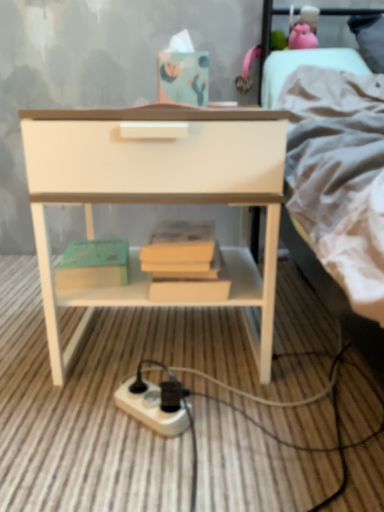
Locate an element on the screen. The image size is (384, 512). green matte paperback book at lower left is located at coordinates (93, 264).

What do you see at coordinates (340, 177) in the screenshot?
I see `light gray fabric bed at upper right` at bounding box center [340, 177].

Locate an element on the screen. green matte paperback book at lower left is located at coordinates (93, 264).

Considering the relative sizes of white plastic power plugs and sockets at lower center and green matte paperback book at lower left in the image provided, is white plastic power plugs and sockets at lower center shorter than green matte paperback book at lower left?

Indeed, white plastic power plugs and sockets at lower center has a lesser height compared to green matte paperback book at lower left.

From a real-world perspective, does white plastic power plugs and sockets at lower center sit lower than green matte paperback book at lower left?

Yes, from a real-world perspective, white plastic power plugs and sockets at lower center is under green matte paperback book at lower left.

Considering the sizes of objects white plastic power plugs and sockets at lower center and green matte paperback book at lower left in the image provided, who is wider, white plastic power plugs and sockets at lower center or green matte paperback book at lower left?

Wider between the two is green matte paperback book at lower left.

Considering the sizes of white plastic power plugs and sockets at lower center and white glossy nightstand at center in the image, is white plastic power plugs and sockets at lower center taller or shorter than white glossy nightstand at center?

white plastic power plugs and sockets at lower center is shorter than white glossy nightstand at center.

Based on their positions, is white plastic power plugs and sockets at lower center located to the left or right of white glossy nightstand at center?

Based on their positions, white plastic power plugs and sockets at lower center is located to the left of white glossy nightstand at center.

From the image's perspective, between white plastic power plugs and sockets at lower center and white glossy nightstand at center, who is located below?

white plastic power plugs and sockets at lower center is shown below in the image.

From a real-world perspective, is green matte paperback book at lower left physically below white plastic power plugs and sockets at lower center?

No, from a real-world perspective, green matte paperback book at lower left is not under white plastic power plugs and sockets at lower center.

Considering the sizes of objects green matte paperback book at lower left and white plastic power plugs and sockets at lower center in the image provided, who is thinner, green matte paperback book at lower left or white plastic power plugs and sockets at lower center?

Thinner between the two is white plastic power plugs and sockets at lower center.

Can you confirm if green matte paperback book at lower left is positioned to the left of white plastic power plugs and sockets at lower center?

Indeed, green matte paperback book at lower left is positioned on the left side of white plastic power plugs and sockets at lower center.

Is white plastic power plugs and sockets at lower center shorter than light gray fabric bed at upper right?

Yes.

From a real-world perspective, who is located higher, white plastic power plugs and sockets at lower center or light gray fabric bed at upper right?

light gray fabric bed at upper right is physically above.

Is point (136, 401) closer or farther from the camera than point (289, 155)?

Point (136, 401) is farther from the camera than point (289, 155).

Are white glossy nightstand at center and green matte paperback book at lower left beside each other?

They are not placed beside each other.

From a real-world perspective, is white glossy nightstand at center physically below green matte paperback book at lower left?

Actually, white glossy nightstand at center is physically above green matte paperback book at lower left in the real world.

Does point (51, 193) lie in front of point (101, 250)?

Yes, it is.

Looking at this image, in the image, is green matte paperback book at lower left on the left side or the right side of light gray fabric bed at upper right?

Clearly, green matte paperback book at lower left is on the left of light gray fabric bed at upper right in the image.

Is green matte paperback book at lower left bigger or smaller than light gray fabric bed at upper right?

Considering their sizes, green matte paperback book at lower left takes up less space than light gray fabric bed at upper right.

Is green matte paperback book at lower left turned away from light gray fabric bed at upper right?

No, green matte paperback book at lower left's orientation is not away from light gray fabric bed at upper right.

Is point (55, 339) closer to viewer compared to point (149, 418)?

No, it is behind (149, 418).

Who is shorter, white glossy nightstand at center or white plastic power plugs and sockets at lower center?

white plastic power plugs and sockets at lower center.

Is white glossy nightstand at center in front of or behind white plastic power plugs and sockets at lower center in the image?

Clearly, white glossy nightstand at center is in front of white plastic power plugs and sockets at lower center.

You are a GUI agent. You are given a task and a screenshot of the screen. Output one action in this format:
    pyautogui.click(x=<x>, y=<y>)
    Task: Click on the power plugs and sockets located underneath the green matte paperback book at lower left (from a real-world perspective)
    Image resolution: width=384 pixels, height=512 pixels.
    Given the screenshot: What is the action you would take?
    pyautogui.click(x=153, y=407)

Where is `power plugs and sockets lying on the left of white glossy nightstand at center`? The height and width of the screenshot is (512, 384). power plugs and sockets lying on the left of white glossy nightstand at center is located at coordinates coord(153,407).

Which object lies further to the anchor point light gray fabric bed at upper right, green matte paperback book at lower left or white plastic power plugs and sockets at lower center?

The object further to light gray fabric bed at upper right is white plastic power plugs and sockets at lower center.

Estimate the real-world distances between objects in this image. Which object is closer to light gray fabric bed at upper right, green matte paperback book at lower left or white glossy nightstand at center?

Based on the image, white glossy nightstand at center appears to be nearer to light gray fabric bed at upper right.

Considering their positions, is white plastic power plugs and sockets at lower center positioned closer to white glossy nightstand at center than green matte paperback book at lower left?

green matte paperback book at lower left is positioned closer to the anchor white glossy nightstand at center.

Which object lies further to the anchor point green matte paperback book at lower left, white plastic power plugs and sockets at lower center or light gray fabric bed at upper right?

light gray fabric bed at upper right.

Estimate the real-world distances between objects in this image. Which object is closer to white glossy nightstand at center, green matte paperback book at lower left or white plastic power plugs and sockets at lower center?

The object closer to white glossy nightstand at center is green matte paperback book at lower left.

From the image, which object appears to be nearer to white plastic power plugs and sockets at lower center, green matte paperback book at lower left or light gray fabric bed at upper right?

green matte paperback book at lower left is closer to white plastic power plugs and sockets at lower center.

Based on their spatial positions, is light gray fabric bed at upper right or white plastic power plugs and sockets at lower center further from green matte paperback book at lower left?

light gray fabric bed at upper right is further to green matte paperback book at lower left.

From the image, which object appears to be farther from light gray fabric bed at upper right, white plastic power plugs and sockets at lower center or green matte paperback book at lower left?

The object further to light gray fabric bed at upper right is white plastic power plugs and sockets at lower center.

Locate an element on the screen. This screenshot has height=512, width=384. paperback book between light gray fabric bed at upper right and white plastic power plugs and sockets at lower center in the vertical direction is located at coordinates (93, 264).

Locate an element on the screen. This screenshot has width=384, height=512. nightstand between light gray fabric bed at upper right and white plastic power plugs and sockets at lower center in the vertical direction is located at coordinates (158, 198).

Where is `paperback book between white glossy nightstand at center and white plastic power plugs and sockets at lower center vertically`? paperback book between white glossy nightstand at center and white plastic power plugs and sockets at lower center vertically is located at coordinates (93, 264).

Find the location of `nightstand between green matte paperback book at lower left and light gray fabric bed at upper right`. nightstand between green matte paperback book at lower left and light gray fabric bed at upper right is located at coordinates (158, 198).